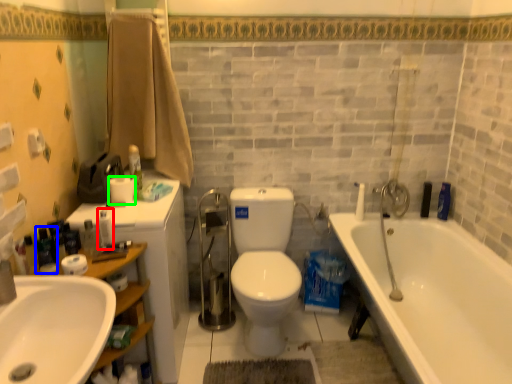
Question: Estimate the real-world distances between objects in this image. Which object is closer to toiletry (highlighted by a red box), toiletry (highlighted by a blue box) or toilet paper (highlighted by a green box)?

Choices:
 (A) toiletry
 (B) toilet paper

Answer: (B)